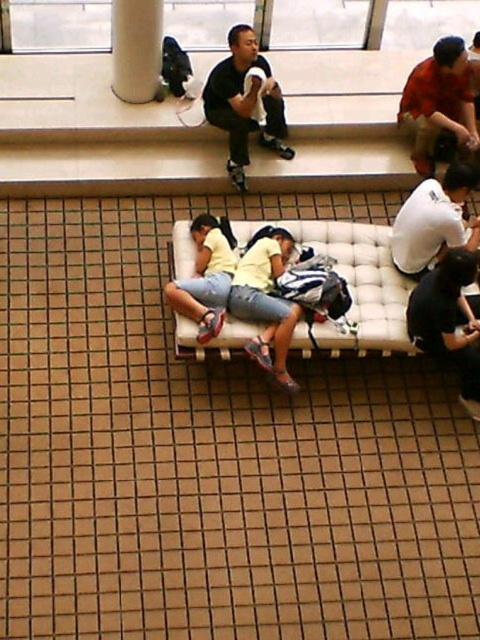
Question: Based on their relative distances, which object is nearer to the reddish-orange shirt at center?

Choices:
 (A) yellow fabric shirt at center
 (B) matte yellow shirt at center

Answer: (A)

Question: Does black matte shirt at upper center come in front of white glossy pillar at upper center?

Choices:
 (A) yes
 (B) no

Answer: (B)

Question: Which object is positioned closest to the black matte shirt at upper center?

Choices:
 (A) beige fabric bench at center
 (B) matte yellow shirt at center

Answer: (B)

Question: Which of the following is the farthest from the observer?

Choices:
 (A) black matte shirt at upper center
 (B) beige fabric bench at center
 (C) matte yellow shirt at center
 (D) yellow fabric shirt at center

Answer: (A)

Question: Can you confirm if white matte shirt at center is smaller than white glossy pillar at upper center?

Choices:
 (A) yes
 (B) no

Answer: (B)

Question: Does black matte shirt at upper center appear on the left side of white glossy pillar at upper center?

Choices:
 (A) no
 (B) yes

Answer: (A)